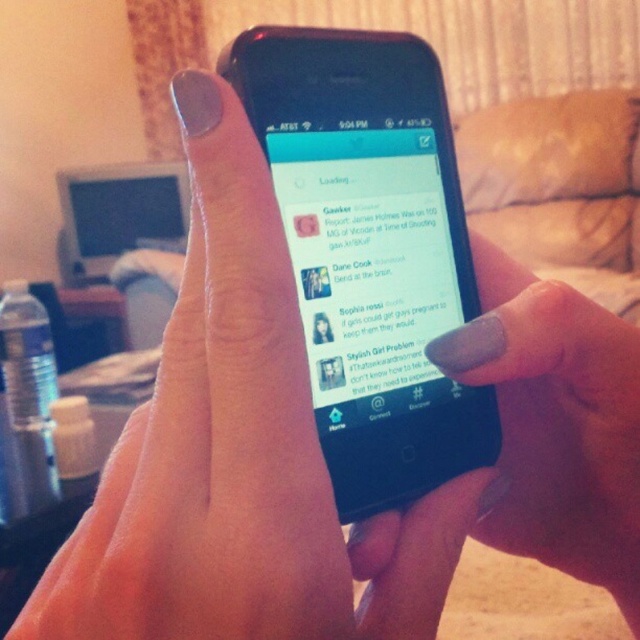
You are a photographer trying to capture a close shot of the phone screen. You want to focus on the point at position (445, 241) and the point at (420, 397). Which point should you adjust your focus to first to ensure both are in the frame?

Point (445, 241) is further to the camera than point (420, 397). Therefore, you should focus on point (445, 241) first to ensure both are in the frame.

A person is holding a smartphone with their hand. There is a point at coordinates point [397,634]. If the person wants to touch the point with their finger, will their finger reach it?

The point at coordinates point [397,634] is 9.65 inches away from the hand. Since the average human finger length is about 2.5 inches, the person cannot reach the point with their finger.